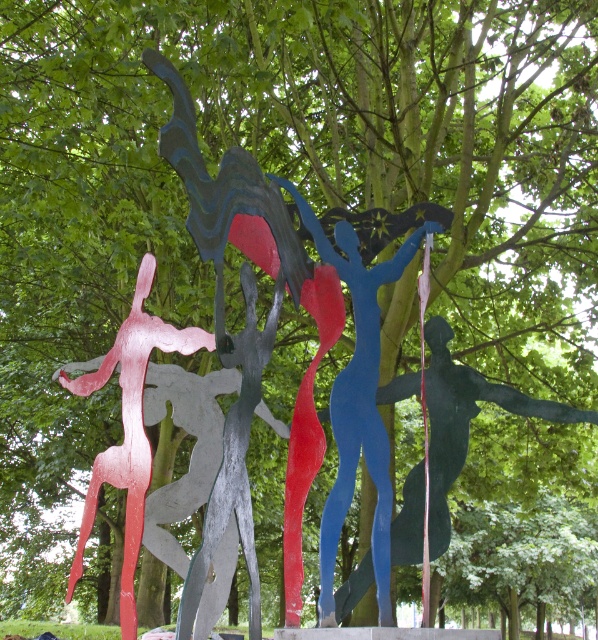
This screenshot has width=598, height=640. Find the location of `metallic blue figure at center`. metallic blue figure at center is located at coordinates (358, 403).

Image resolution: width=598 pixels, height=640 pixels. What do you see at coordinates (358, 403) in the screenshot? I see `metallic blue figure at center` at bounding box center [358, 403].

Locate an element on the screen. metallic blue figure at center is located at coordinates (358, 403).

Can you confirm if metallic blue figure at center is smaller than blue glossy figure at center?

Indeed, metallic blue figure at center has a smaller size compared to blue glossy figure at center.

Is metallic blue figure at center to the left of blue glossy figure at center from the viewer's perspective?

Yes, metallic blue figure at center is to the left of blue glossy figure at center.

Is point (346, 369) farther from viewer compared to point (575, 412)?

No, it is in front of (575, 412).

You are a GUI agent. You are given a task and a screenshot of the screen. Output one action in this format:
    pyautogui.click(x=<x>, y=<y>)
    Task: Click on the metallic blue figure at center
    The width and height of the screenshot is (598, 640).
    Given the screenshot: What is the action you would take?
    pyautogui.click(x=358, y=403)

Is blue glossy figure at center wider than metallic pink figure at left?

Correct, the width of blue glossy figure at center exceeds that of metallic pink figure at left.

Which is behind, point (596, 413) or point (151, 260)?

The point (596, 413) is behind.

Where is `blue glossy figure at center`? blue glossy figure at center is located at coordinates (465, 420).